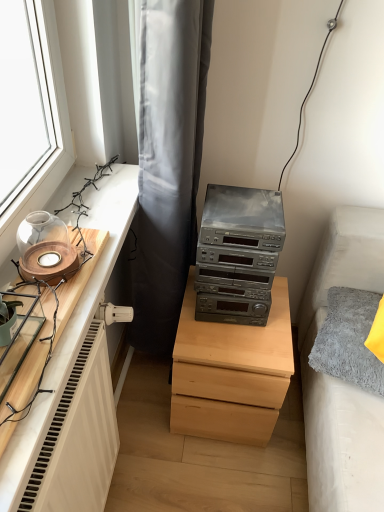
Question: Is gray fabric curtain at upper center thinner than light wood chest of drawers at center?

Choices:
 (A) yes
 (B) no

Answer: (A)

Question: Is gray fabric curtain at upper center looking in the opposite direction of light wood chest of drawers at center?

Choices:
 (A) no
 (B) yes

Answer: (A)

Question: Can you confirm if gray fabric curtain at upper center is smaller than light wood chest of drawers at center?

Choices:
 (A) yes
 (B) no

Answer: (B)

Question: Is gray fabric curtain at upper center facing towards light wood chest of drawers at center?

Choices:
 (A) yes
 (B) no

Answer: (A)

Question: Is gray fabric curtain at upper center further to the viewer compared to light wood chest of drawers at center?

Choices:
 (A) yes
 (B) no

Answer: (B)

Question: Can you confirm if gray fabric curtain at upper center is taller than light wood chest of drawers at center?

Choices:
 (A) yes
 (B) no

Answer: (A)

Question: Is metallic gray stereo at center at the left side of wooden candle holder at left?

Choices:
 (A) yes
 (B) no

Answer: (B)

Question: Is metallic gray stereo at center not within wooden candle holder at left?

Choices:
 (A) no
 (B) yes

Answer: (B)

Question: Does metallic gray stereo at center have a lesser height compared to wooden candle holder at left?

Choices:
 (A) yes
 (B) no

Answer: (B)

Question: From a real-world perspective, is metallic gray stereo at center physically below wooden candle holder at left?

Choices:
 (A) yes
 (B) no

Answer: (A)

Question: Is metallic gray stereo at center turned away from wooden candle holder at left?

Choices:
 (A) no
 (B) yes

Answer: (A)

Question: Is metallic gray stereo at center further to the viewer compared to wooden candle holder at left?

Choices:
 (A) no
 (B) yes

Answer: (B)

Question: Does metallic gray stereo at center have a smaller size compared to gray fabric curtain at upper center?

Choices:
 (A) no
 (B) yes

Answer: (B)